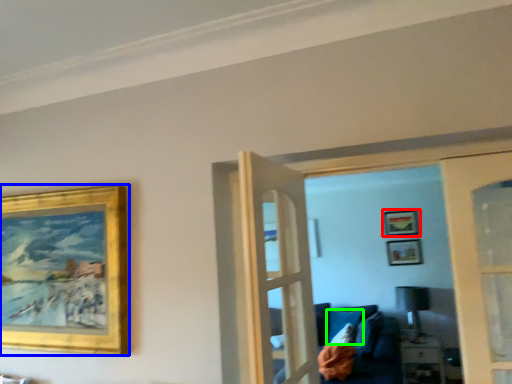
Question: Considering the real-world distances, which object is closest to picture frame (highlighted by a red box)? picture frame (highlighted by a blue box) or pillow (highlighted by a green box).

Choices:
 (A) picture frame
 (B) pillow

Answer: (B)